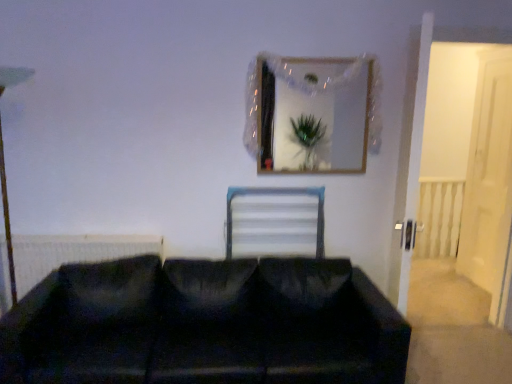
Question: Is wooden frame at upper center surrounding black fabric studio couch at lower center?

Choices:
 (A) yes
 (B) no

Answer: (B)

Question: From the image's perspective, is wooden frame at upper center located above black fabric studio couch at lower center?

Choices:
 (A) no
 (B) yes

Answer: (B)

Question: Does wooden frame at upper center have a lesser width compared to black fabric studio couch at lower center?

Choices:
 (A) no
 (B) yes

Answer: (B)

Question: Is wooden frame at upper center bigger than black fabric studio couch at lower center?

Choices:
 (A) no
 (B) yes

Answer: (A)

Question: Is wooden frame at upper center far from black fabric studio couch at lower center?

Choices:
 (A) yes
 (B) no

Answer: (A)

Question: From a real-world perspective, relative to white glossy door at right, is black matte radiator at left vertically above or below?

Choices:
 (A) above
 (B) below

Answer: (B)

Question: Does point (136, 240) appear closer or farther from the camera than point (480, 264)?

Choices:
 (A) farther
 (B) closer

Answer: (B)

Question: Is black matte radiator at left taller or shorter than white glossy door at right?

Choices:
 (A) tall
 (B) short

Answer: (B)

Question: Is black matte radiator at left situated inside white glossy door at right or outside?

Choices:
 (A) inside
 (B) outside

Answer: (B)

Question: In terms of width, does black matte radiator at left look wider or thinner when compared to white plastic radiator at center?

Choices:
 (A) thin
 (B) wide

Answer: (A)

Question: In the image, is black matte radiator at left positioned in front of or behind white plastic radiator at center?

Choices:
 (A) behind
 (B) front

Answer: (B)

Question: From the image's perspective, is black matte radiator at left positioned above or below white plastic radiator at center?

Choices:
 (A) above
 (B) below

Answer: (B)

Question: Would you say black matte radiator at left is to the left or to the right of white plastic radiator at center in the picture?

Choices:
 (A) left
 (B) right

Answer: (A)

Question: In terms of width, does white plastic radiator at center look wider or thinner when compared to white glossy door at right?

Choices:
 (A) wide
 (B) thin

Answer: (A)

Question: Visually, is white plastic radiator at center positioned to the left or to the right of white glossy door at right?

Choices:
 (A) right
 (B) left

Answer: (B)